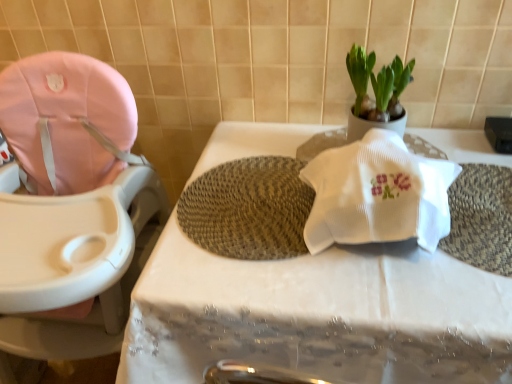
Question: Is woven beige bath mat at center spatially inside white fabric table at center, or outside of it?

Choices:
 (A) inside
 (B) outside

Answer: (B)

Question: From a real-world perspective, relative to white fabric table at center, is woven beige bath mat at center vertically above or below?

Choices:
 (A) above
 (B) below

Answer: (A)

Question: Which object is positioned farthest from the white fabric table at center?

Choices:
 (A) white matte pot at upper right
 (B) pink fabric baby carriage at left
 (C) woven beige bath mat at center

Answer: (A)

Question: Which is farther from the white matte pot at upper right?

Choices:
 (A) white fabric table at center
 (B) pink fabric baby carriage at left
 (C) woven beige bath mat at center

Answer: (B)